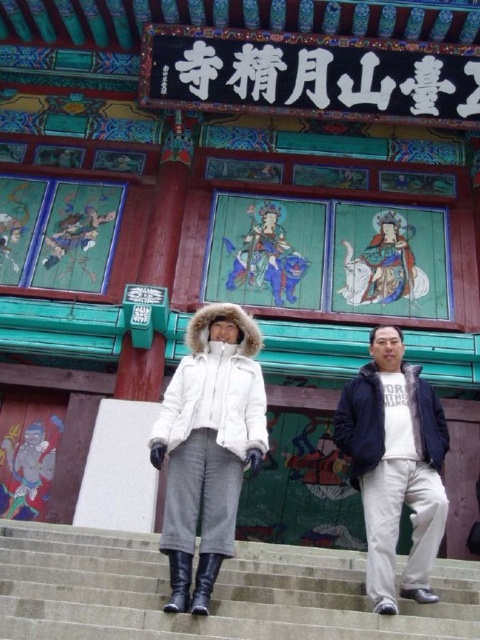
Is gray concrete stairs at center taller than white cotton pants at right?

Incorrect, gray concrete stairs at center's height is not larger of white cotton pants at right's.

Who is more forward, (103, 556) or (380, 500)?

Point (380, 500)

Is point (139, 536) behind point (376, 563)?

Yes.

You are a GUI agent. You are given a task and a screenshot of the screen. Output one action in this format:
    pyautogui.click(x=<x>, y=<y>)
    Task: Click on the gray concrete stairs at center
    The height and width of the screenshot is (640, 480).
    Given the screenshot: What is the action you would take?
    pyautogui.click(x=213, y=595)

Who is taller, white fur-trimmed coat at center or white cotton pants at right?

With more height is white cotton pants at right.

Is white fur-trimmed coat at center below white cotton pants at right?

Actually, white fur-trimmed coat at center is above white cotton pants at right.

Is point (233, 381) less distant than point (337, 429)?

Yes, point (233, 381) is in front of point (337, 429).

Identify the location of white fur-trimmed coat at center. This screenshot has height=640, width=480. (207, 445).

Measure the distance from gray concrete stairs at center to white fur-trimmed coat at center.

The distance of gray concrete stairs at center from white fur-trimmed coat at center is 5.82 meters.

Is gray concrete stairs at center to the left of white fur-trimmed coat at center from the viewer's perspective?

In fact, gray concrete stairs at center is to the right of white fur-trimmed coat at center.

Identify the location of gray concrete stairs at center. Image resolution: width=480 pixels, height=640 pixels. (213, 595).